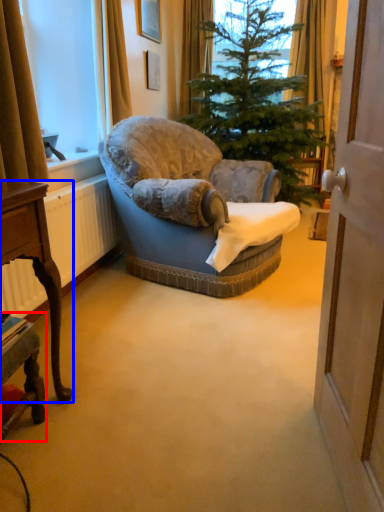
Question: Which object appears farthest to the camera in this image, desk (highlighted by a red box) or desk (highlighted by a blue box)?

Choices:
 (A) desk
 (B) desk

Answer: (A)